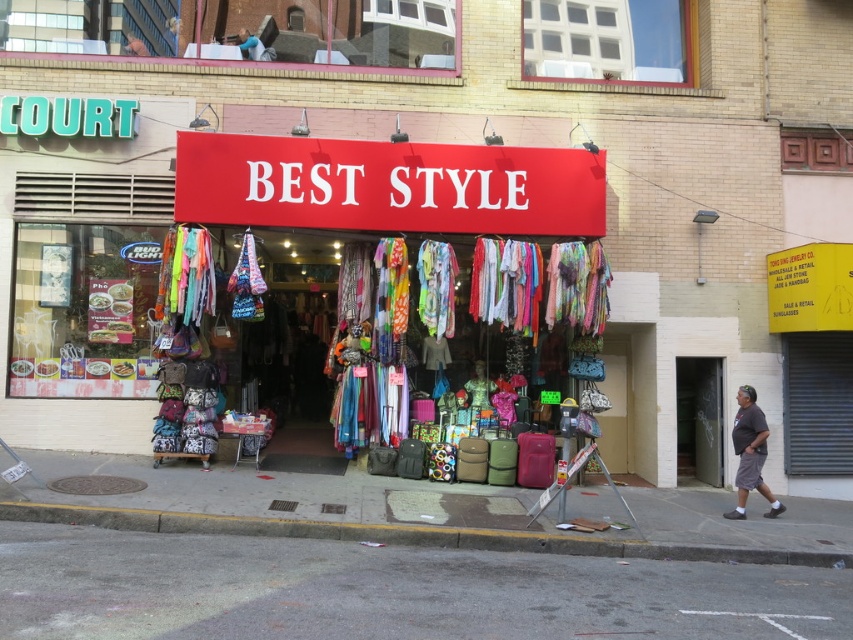
Based on the photo, you are standing in front of the BEST STYLE store and want to place a new display stand for the gray cotton shorts at lower right. Where should you position it relative to the concrete at lower left?

You should position the display stand for the gray cotton shorts at lower right to the right of the concrete at lower left, as the concrete at lower left is already located to the left of the gray cotton shorts at lower right.

You are a customer entering the BEST STYLE store and see the textile fabric scarves at center and the gray cotton shorts at lower right. Which item is positioned higher up?

The textile fabric scarves at center are positioned higher up than the gray cotton shorts at lower right.

You are a delivery person carrying a package that requires a 3 meter clearance to maneuver. You need to move from the sidewalk to the entrance of BEST STYLE. Is the space between the gray asphalt at lower center and the textile fabric scarves at center wide enough for your delivery vehicle?

The distance between the gray asphalt at lower center and the textile fabric scarves at center is 5.06 meters, which is wider than the required 3 meter clearance. Therefore, the delivery vehicle can safely maneuver through the space between the gray asphalt at lower center and the textile fabric scarves at center.